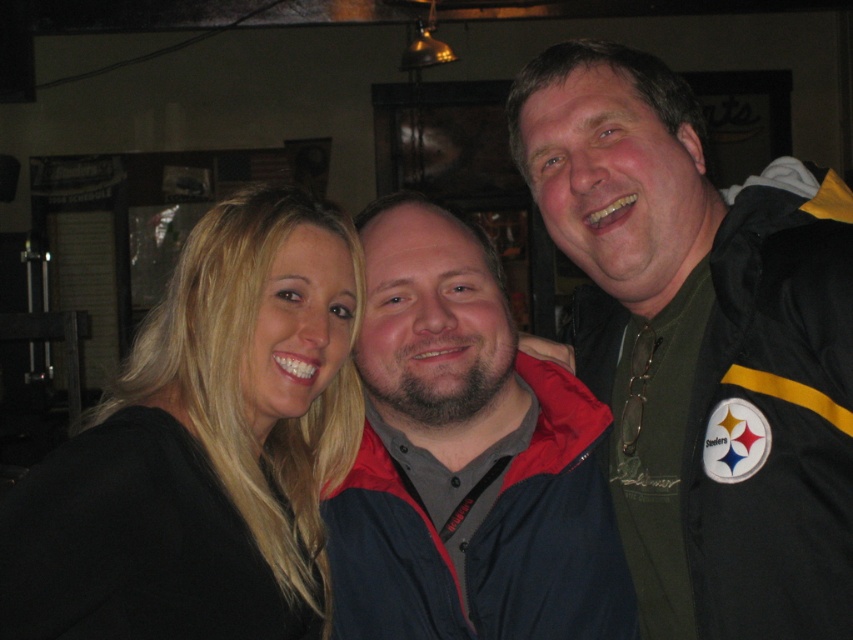
Which of these two, black fabric jacket at right or dark blue jacket at center, stands shorter?

With less height is dark blue jacket at center.

Who is more distant from viewer, (811, 442) or (502, 579)?

The point (502, 579) is behind.

Locate an element on the screen. The width and height of the screenshot is (853, 640). black fabric jacket at right is located at coordinates (701, 346).

Does point (1, 604) come farther from viewer compared to point (378, 422)?

No, (1, 604) is in front of (378, 422).

Does point (79, 436) come in front of point (416, 460)?

That is True.

The width and height of the screenshot is (853, 640). I want to click on black matte hair at center, so click(x=190, y=465).

Identify the location of black matte hair at center. (190, 465).

The image size is (853, 640). Identify the location of black fabric jacket at right. (701, 346).

Which of these two, black fabric jacket at right or black matte hair at center, stands taller?

With more height is black fabric jacket at right.

Who is more distant from viewer, (x=758, y=554) or (x=178, y=611)?

The point (x=758, y=554) is behind.

What are the coordinates of `black fabric jacket at right` in the screenshot? It's located at (701, 346).